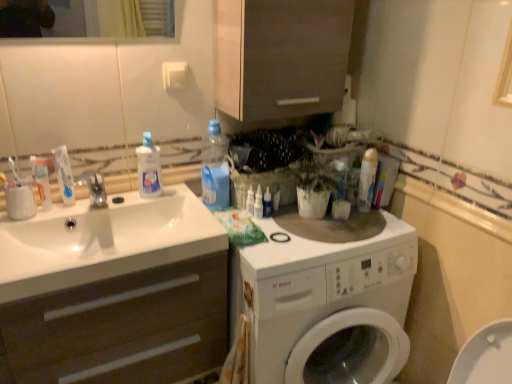
Locate an element on the screen. The width and height of the screenshot is (512, 384). free space on the front side of white glossy bottle at center, which ranks as the 3th toiletry in left-to-right order is located at coordinates (294, 232).